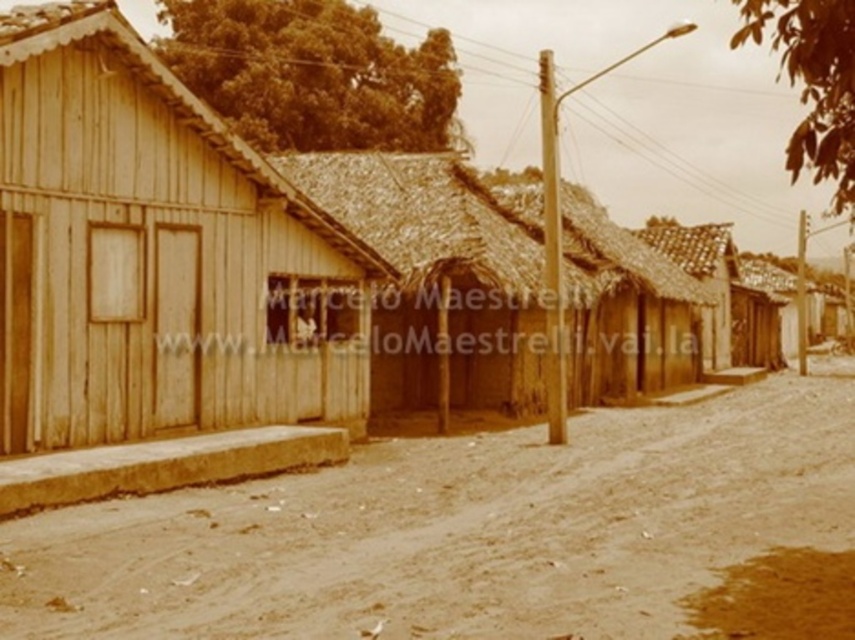
You are a traveler wanting to stay in the largest available accommodation. Based on the scene, which of the two huts would you choose between the wooden hut at left and the thatched roof hut at center?

The thatched roof hut at center is wider than the wooden hut at left, so you should choose the thatched roof hut at center for a larger accommodation.

You are standing on the street looking towards the houses. Which wooden structure is positioned lower in the image, the wooden hut at left or the brown wooden hut at center?

The wooden hut at left is positioned lower in the image than the brown wooden hut at center.